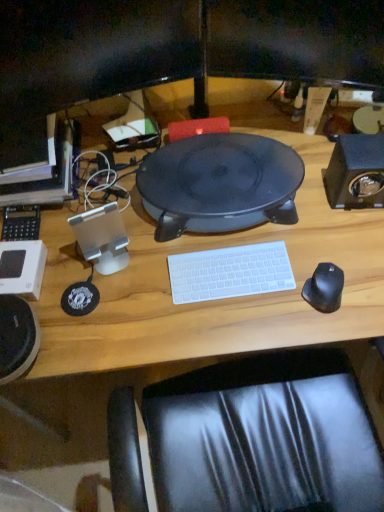
The image size is (384, 512). Find the location of `free space to the back side of black matte mouse at right`. free space to the back side of black matte mouse at right is located at coordinates (312, 241).